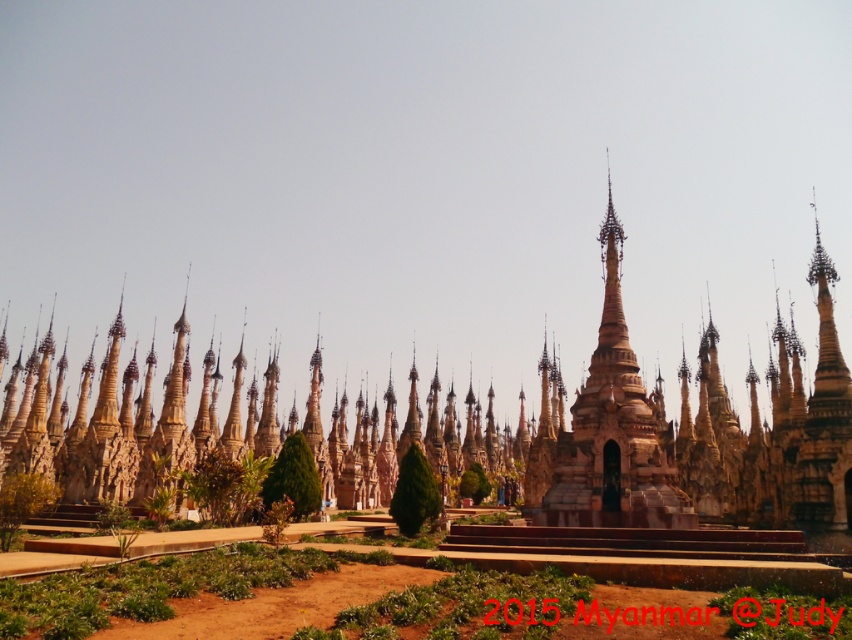
You are standing at the entrance of the stupa complex and want to locate the brown stone pagoda at center. According to the coordinates provided, where should you look to find it?

The brown stone pagoda at center is located at coordinates point (x=626, y=429).

You are standing at the entrance of the stupa complex and notice two points marked in the image. From your current position, which of the two points, point (499,451) or point (551,515), is closer to you?

Point (551,515) is closer to you because it is in front of point (499,451).

You are a tourist standing in front of the brown stone pagoda at center and the golden polished stupa at center. Which one is positioned higher in the image?

The brown stone pagoda at center is above the golden polished stupa at center, so it is positioned higher in the image.